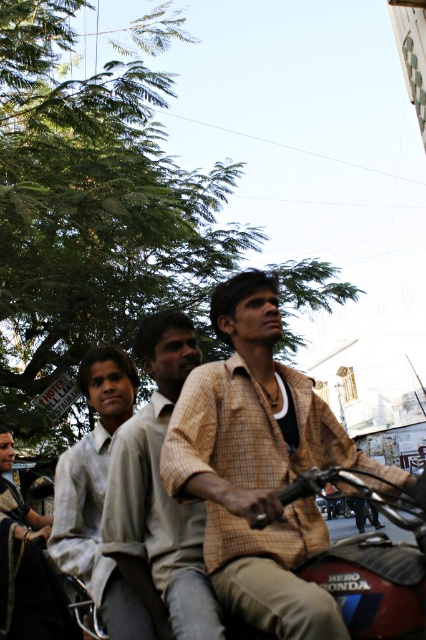
Is red glossy motorcycle at center below light gray shirt at left?

Incorrect, red glossy motorcycle at center is not positioned below light gray shirt at left.

Is point (357, 580) more distant than point (115, 369)?

No, (357, 580) is in front of (115, 369).

Identify the location of red glossy motorcycle at center. Image resolution: width=426 pixels, height=640 pixels. (371, 564).

Does point (97, 390) come closer to viewer compared to point (45, 538)?

Yes, point (97, 390) is in front of point (45, 538).

Does light gray shirt at left have a greater height compared to dark green fabric sari at lower left?

Yes.

The height and width of the screenshot is (640, 426). What do you see at coordinates (97, 493) in the screenshot?
I see `light gray shirt at left` at bounding box center [97, 493].

This screenshot has height=640, width=426. Identify the location of light gray shirt at left. (97, 493).

Is point (152, 563) in front of point (120, 593)?

Yes, point (152, 563) is closer to viewer.

Is point (132, 481) positioned in front of point (141, 609)?

No, (132, 481) is further to viewer.

At what (x,y) coordinates should I click in order to perform the action: click on light brown checkered shirt at center. Please return your answer as a coordinate pair (x, y). The height and width of the screenshot is (640, 426). Looking at the image, I should click on (158, 493).